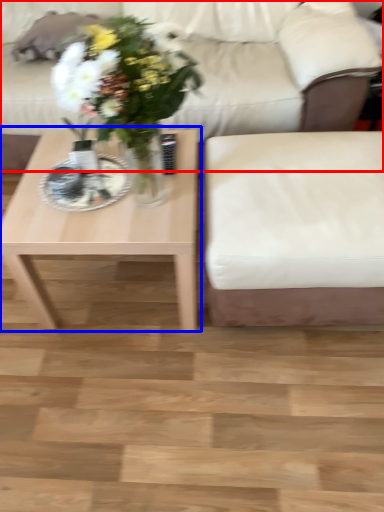
Question: Which point is further to the camera, studio couch (highlighted by a red box) or coffee table (highlighted by a blue box)?

Choices:
 (A) studio couch
 (B) coffee table

Answer: (A)